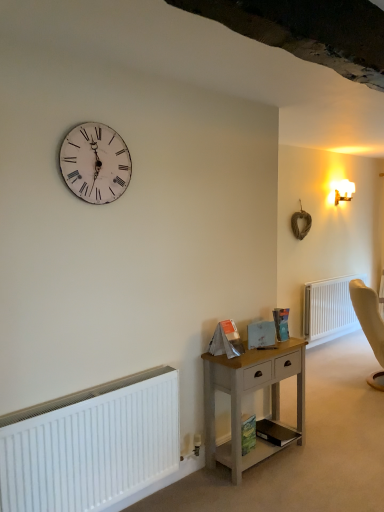
Image resolution: width=384 pixels, height=512 pixels. I want to click on free spot above white matte radiator at lower left, which ranks as the second radiator in right-to-left order (from a real-world perspective), so click(x=105, y=386).